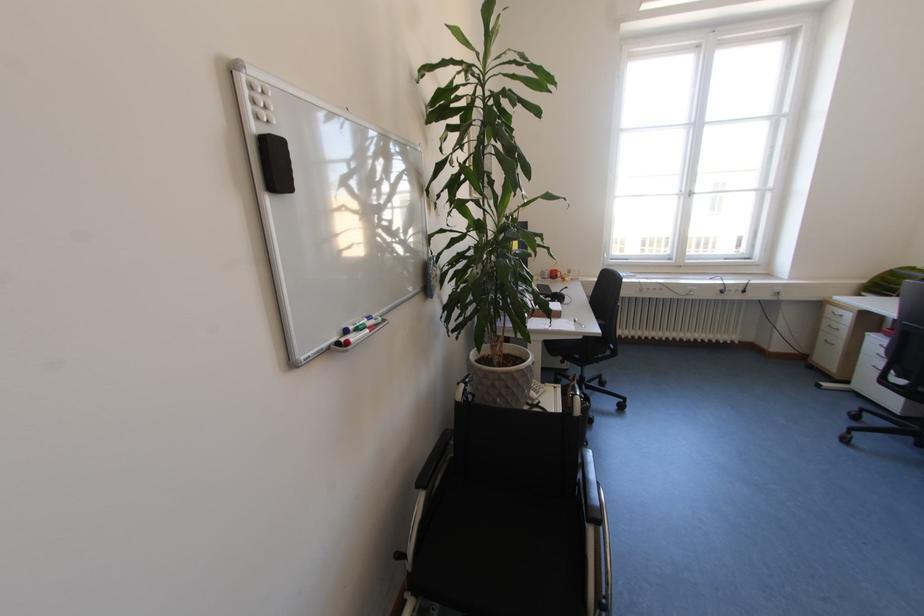
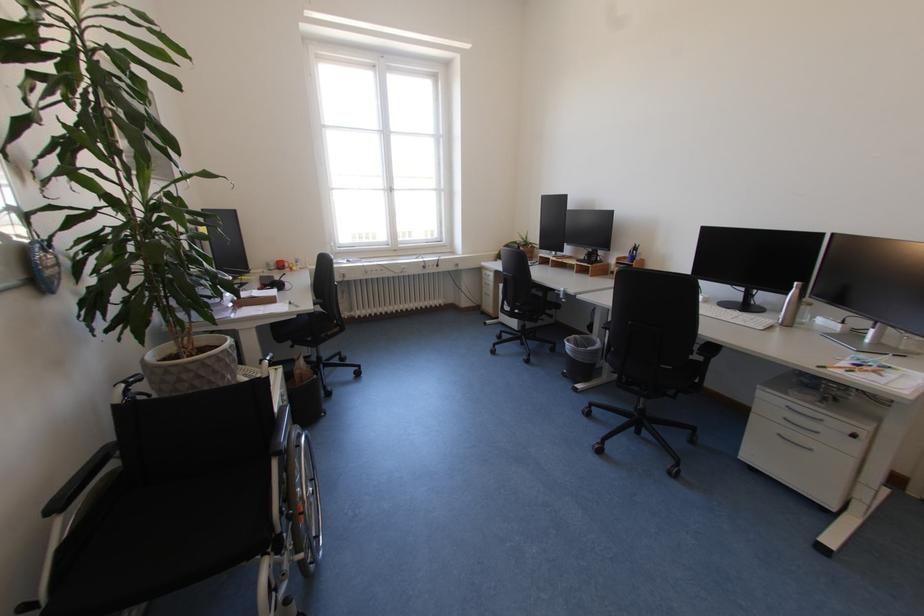
Question: The camera is either moving clockwise (left) or counter-clockwise (right) around the object. The first image is from the beginning of the video and the second image is from the end. Is the camera moving left or right when shooting the video?

Choices:
 (A) Left
 (B) Right

Answer: (A)